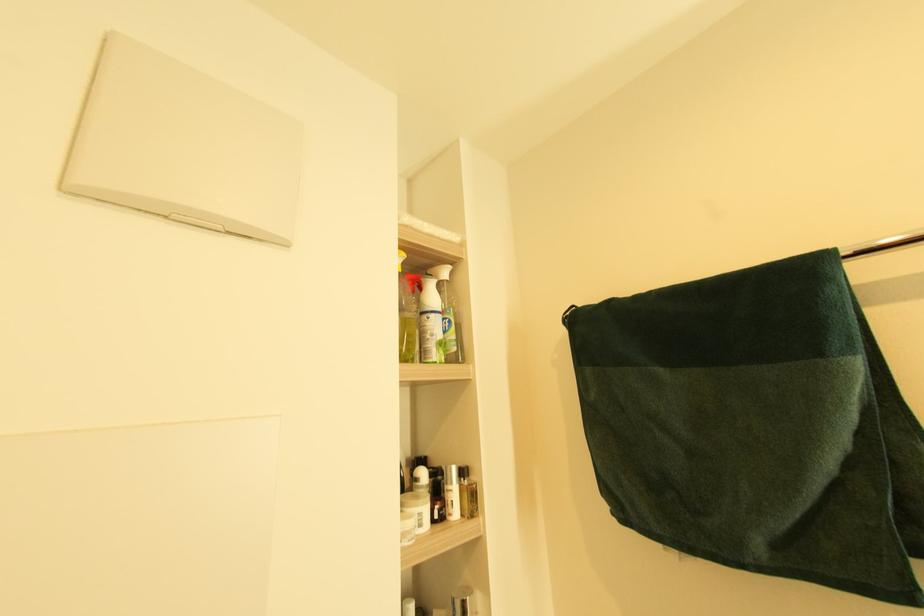
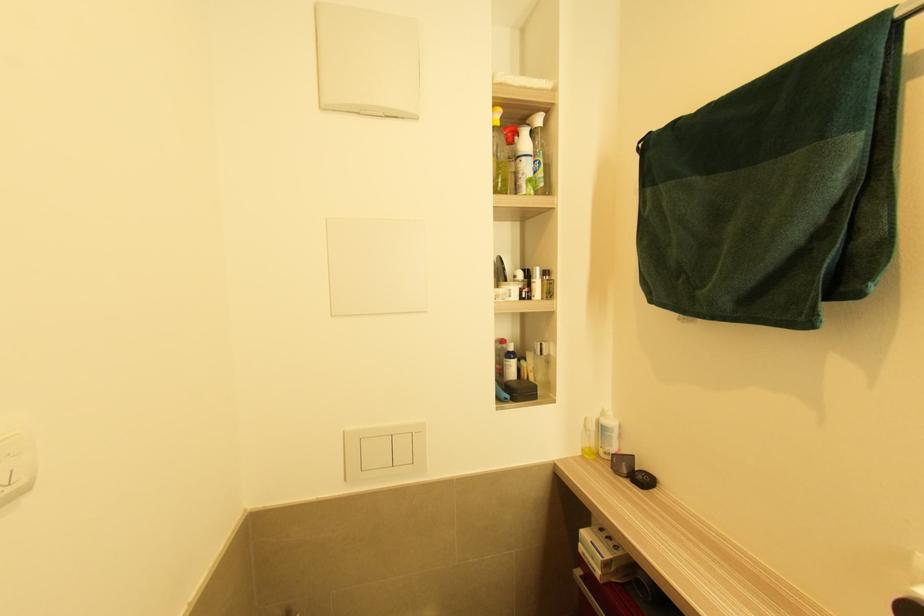
How did the camera likely rotate?

The camera rotated toward left-down.